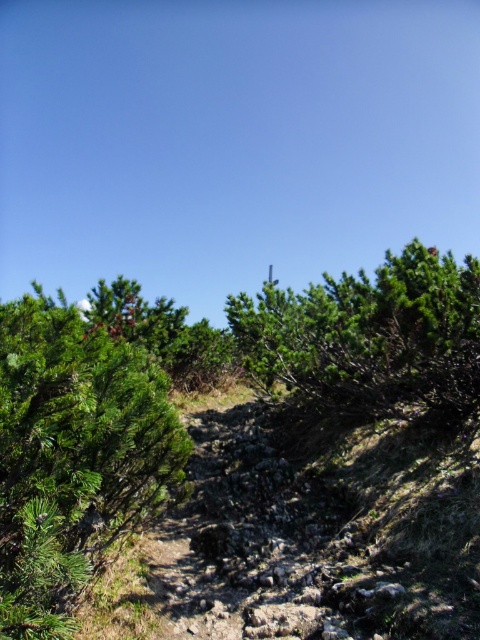
Is green matte bush at left shorter than green matte tree at upper center?

Yes.

What do you see at coordinates (73, 456) in the screenshot? This screenshot has width=480, height=640. I see `green matte bush at left` at bounding box center [73, 456].

This screenshot has height=640, width=480. What are the coordinates of `green matte bush at left` in the screenshot? It's located at (73, 456).